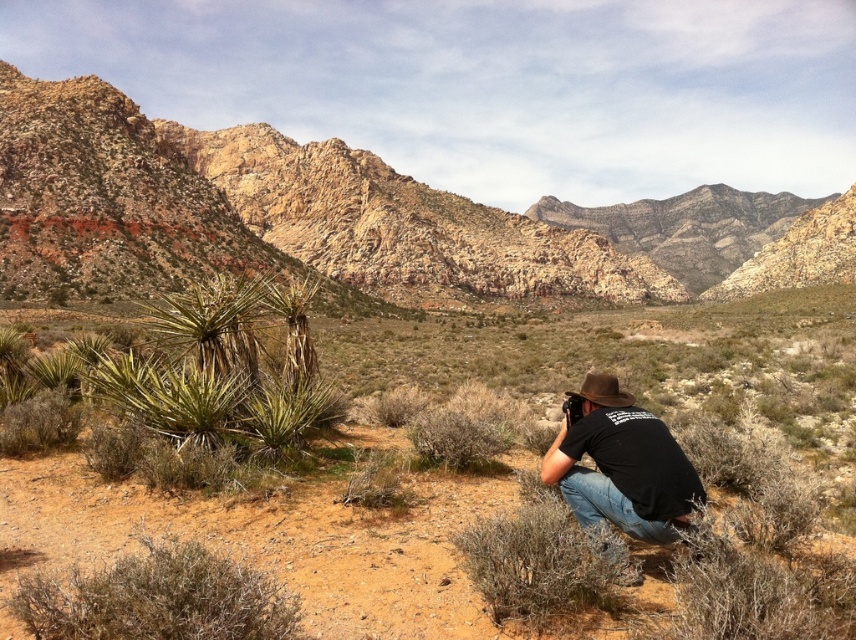
Question: Is dry shrub at lower left below black cotton shirt at center?

Choices:
 (A) no
 (B) yes

Answer: (B)

Question: Which point is farther from the camera taking this photo?

Choices:
 (A) (607, 509)
 (B) (52, 595)

Answer: (A)

Question: Which point is farther to the camera?

Choices:
 (A) (617, 294)
 (B) (603, 388)

Answer: (A)

Question: Is black cotton shirt at center to the right of brown felt cowboy hat at center from the viewer's perspective?

Choices:
 (A) no
 (B) yes

Answer: (A)

Question: Among these objects, which one is nearest to the camera?

Choices:
 (A) brown felt cowboy hat at center
 (B) green shrubs at center

Answer: (B)

Question: Can you confirm if green shrubs at center is positioned to the left of rugged rock formation at upper left?

Choices:
 (A) yes
 (B) no

Answer: (B)